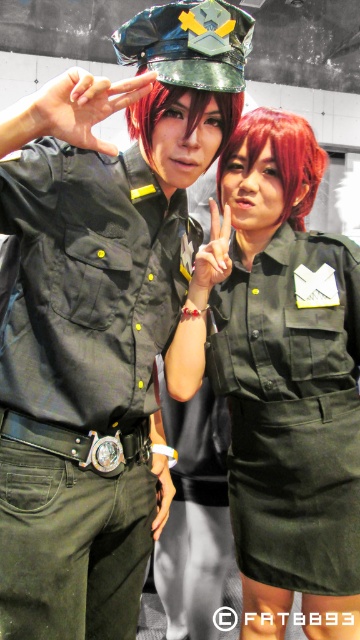
You are a photographer setting up for a group photo. You have two subjects wearing the matte black shirt at left and the matte green uniform at center. To ensure both are framed properly, which clothing item should you adjust the camera angle to focus on first?

The matte black shirt at left is shorter than the matte green uniform at center, so you should focus on the matte green uniform at center first to ensure proper framing.

You are taking a photo of two cosplayers in the scene. The camera is positioned at the center of the image. You want to ensure both points, point (307, 392) and point (150, 115), are in focus. Which point is closer to the camera?

Point (150, 115) is closer to the camera than point (307, 392) because the description states that point (307, 392) is further away.

Looking at this image, you are standing in front of the image and notice a specific point at coordinates (285, 378). What object is located exactly at that point?

The matte green uniform at center is located exactly at point (285, 378).